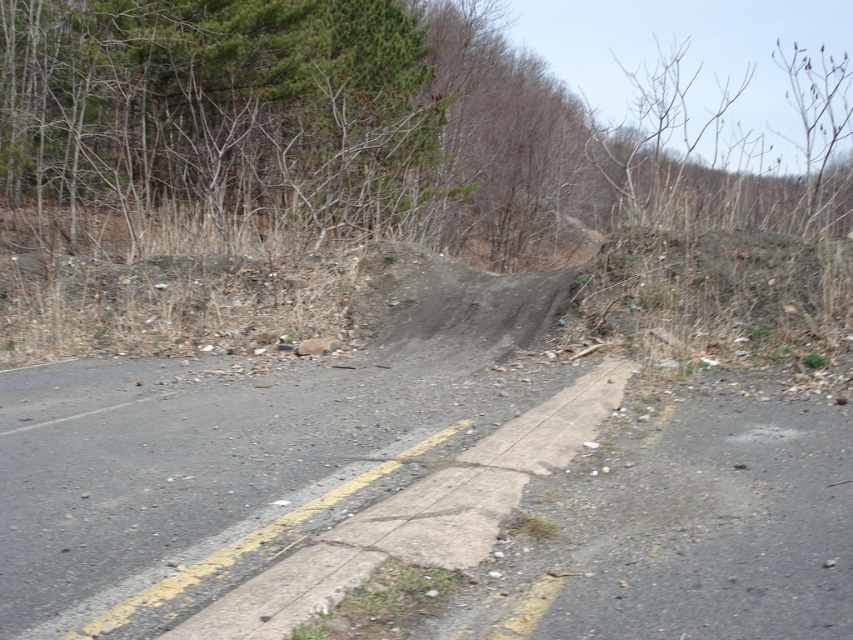
You are a driver approaching the gravelly asphalt road at center. You notice a green leafy tree at upper left in the distance. Which object appears wider from your current viewpoint?

The green leafy tree at upper left appears wider than the gravelly asphalt road at center because its width is larger according to the description.

You are a pedestrian standing on the gravelly asphalt road at center. You want to reach the green leafy tree at upper left. Which direction should you walk to get there?

The green leafy tree at upper left is above the gravelly asphalt road at center, so you should walk towards the upper direction to reach the green leafy tree at upper left.